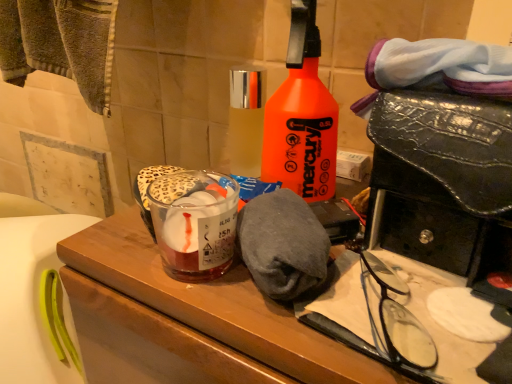
Question: Considering their positions, is black plastic glasses at lower right located in front of or behind wooden vanity at center?

Choices:
 (A) front
 (B) behind

Answer: (B)

Question: From a real-world perspective, relative to wooden vanity at center, is black plastic glasses at lower right vertically above or below?

Choices:
 (A) below
 (B) above

Answer: (B)

Question: Which of these objects is positioned farthest from the wooden vanity at center?

Choices:
 (A) translucent glass at center
 (B) clear glass bottle at center, acting as the 1th bottle starting from the left
 (C) black plastic glasses at lower right
 (D) orange matte spray bottle at center, the 1th bottle viewed from the right

Answer: (B)

Question: Considering the real-world distances, which object is farthest from the clear glass bottle at center, acting as the 1th bottle starting from the left?

Choices:
 (A) translucent glass at center
 (B) black plastic glasses at lower right
 (C) orange matte spray bottle at center, arranged as the second bottle when viewed from the left
 (D) wooden vanity at center

Answer: (B)